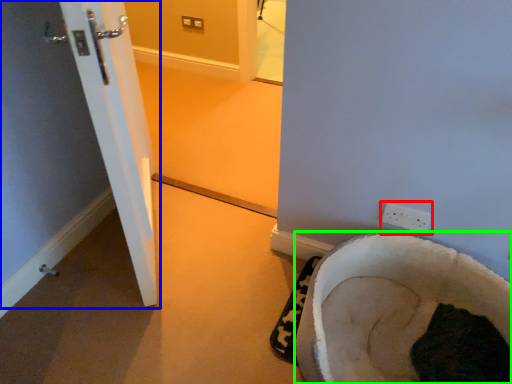
Question: Estimate the real-world distances between objects in this image. Which object is closer to electric outlet (highlighted by a red box), door (highlighted by a blue box) or furniture (highlighted by a green box)?

Choices:
 (A) door
 (B) furniture

Answer: (B)